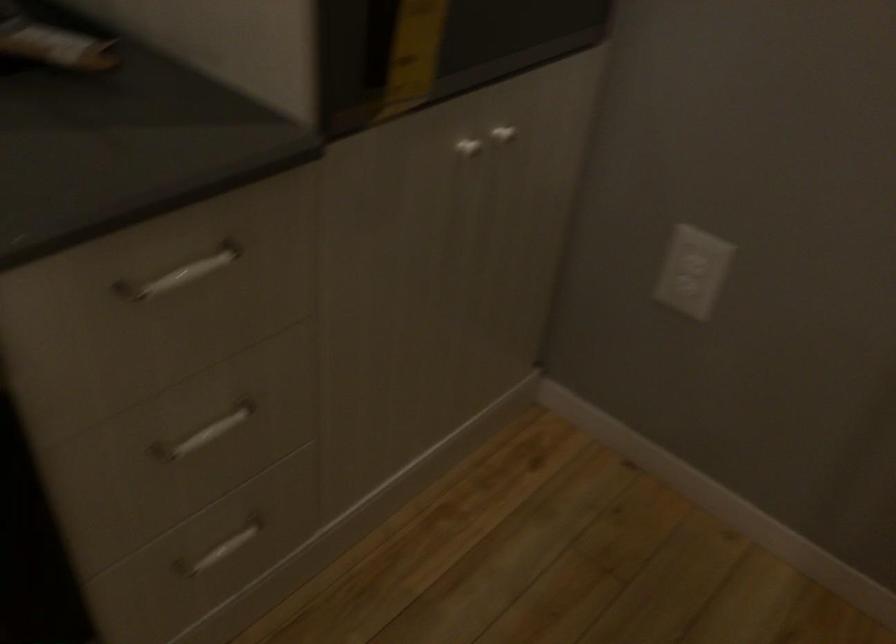
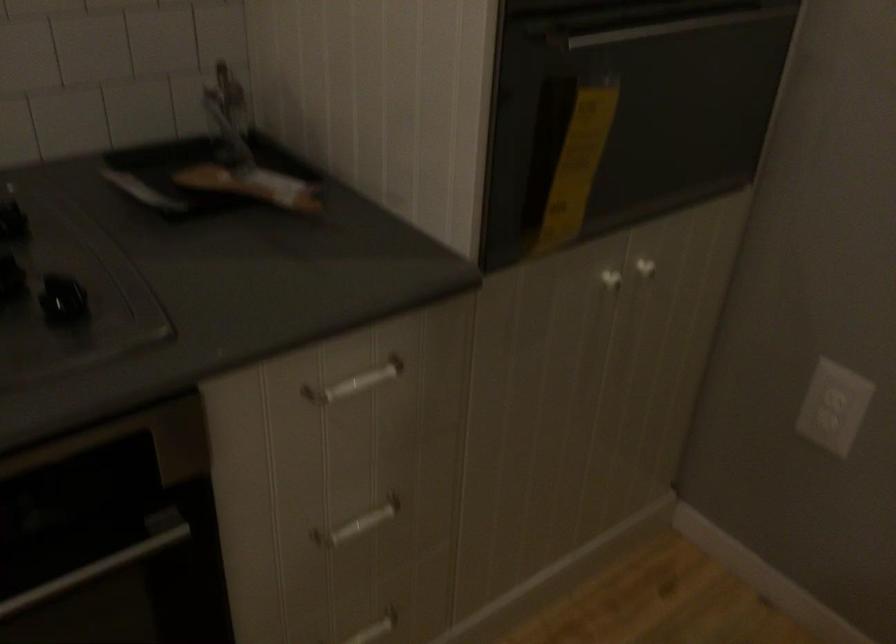
The point at (187,275) is marked in the first image. Where is the corresponding point in the second image?

(355, 383)